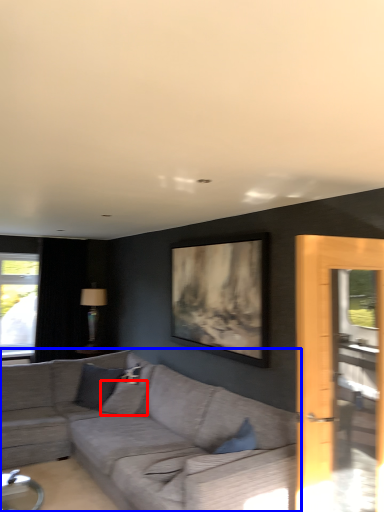
Question: Which object appears closest to the camera in this image, pillow (highlighted by a red box) or studio couch (highlighted by a blue box)?

Choices:
 (A) pillow
 (B) studio couch

Answer: (B)